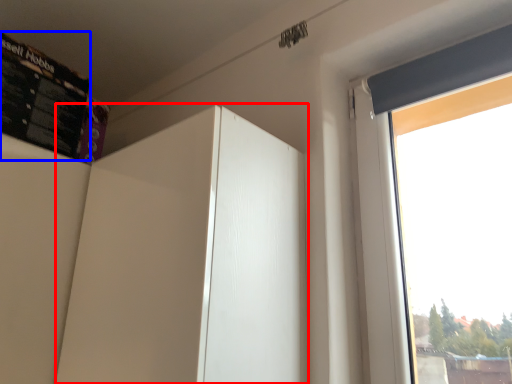
Question: Which object appears closest to the camera in this image, screen door (highlighted by a red box) or bulletin board (highlighted by a blue box)?

Choices:
 (A) screen door
 (B) bulletin board

Answer: (A)